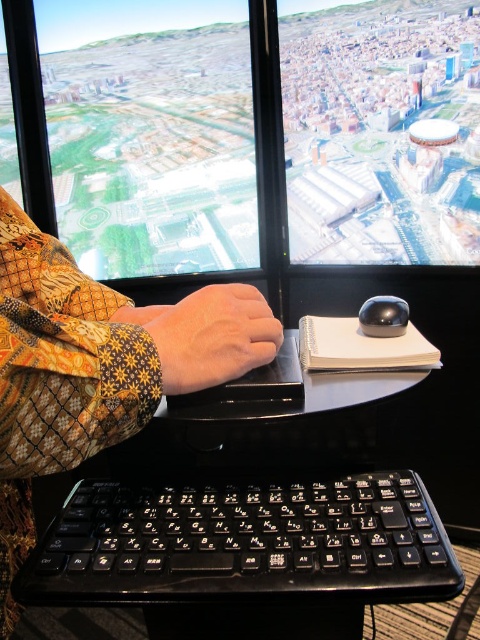
Question: Is black plastic table at center to the right of black plastic keyboard at lower center from the viewer's perspective?

Choices:
 (A) no
 (B) yes

Answer: (B)

Question: Which point appears farthest from the camera in this image?

Choices:
 (A) (17, 209)
 (B) (60, 557)
 (C) (400, 540)
 (D) (371, 316)

Answer: (D)

Question: Which of the following is the farthest from the observer?

Choices:
 (A) (205, 577)
 (B) (156, 333)
 (C) (87, 316)

Answer: (C)

Question: Is black plastic table at center in front of patterned fabric sleeve at center?

Choices:
 (A) yes
 (B) no

Answer: (B)

Question: Which of the following is the farthest from the observer?

Choices:
 (A) (145, 525)
 (B) (113, 387)
 (C) (408, 312)

Answer: (C)

Question: From the image, what is the correct spatial relationship of leather-like hand at center in relation to satin black mouse at center?

Choices:
 (A) below
 (B) above

Answer: (A)